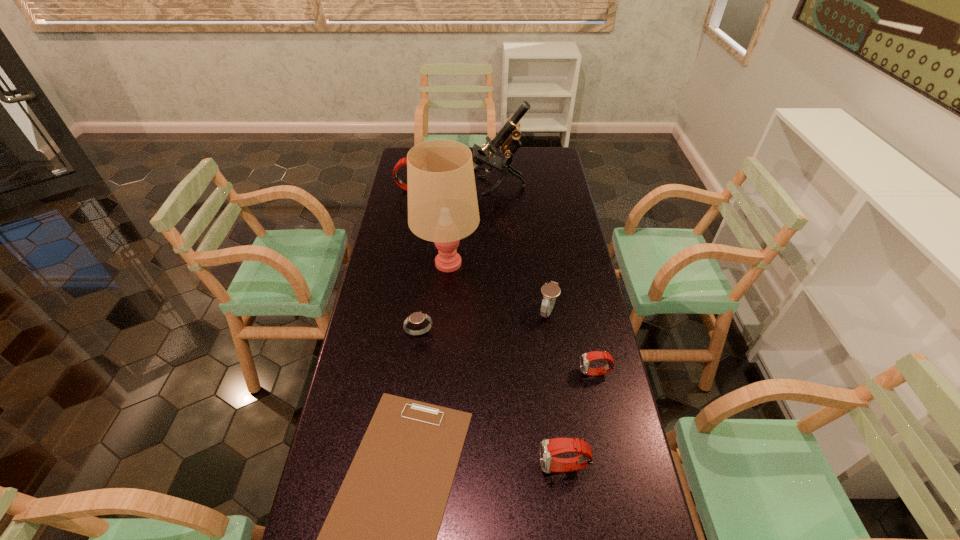
This screenshot has height=540, width=960. I want to click on the rightmost watch, so click(586, 358).

I want to click on the fourth nearest object, so click(417, 317).

I want to click on the nearer gray watch, so click(x=417, y=317).

The width and height of the screenshot is (960, 540). I want to click on free region located on the front of the third farthest object, so click(441, 339).

The image size is (960, 540). I want to click on vacant space situated 0.060m through the eyepiece of the microscope, so click(x=450, y=186).

Where is `vacant space located 0.060m through the eyepiece of the microscope`? This screenshot has height=540, width=960. vacant space located 0.060m through the eyepiece of the microscope is located at coordinates (450, 186).

This screenshot has height=540, width=960. In order to click on free spot located through the eyepiece of the microscope in this screenshot , I will do `click(438, 186)`.

Where is `vacant space located on the face of the farthest watch`? The height and width of the screenshot is (540, 960). vacant space located on the face of the farthest watch is located at coordinates (501, 189).

Find the location of a particular element. This screenshot has height=540, width=960. free space located on the face of the second smallest red watch is located at coordinates (420, 467).

Find the location of a particular element. This screenshot has width=960, height=540. free space located on the face of the second smallest red watch is located at coordinates (455, 467).